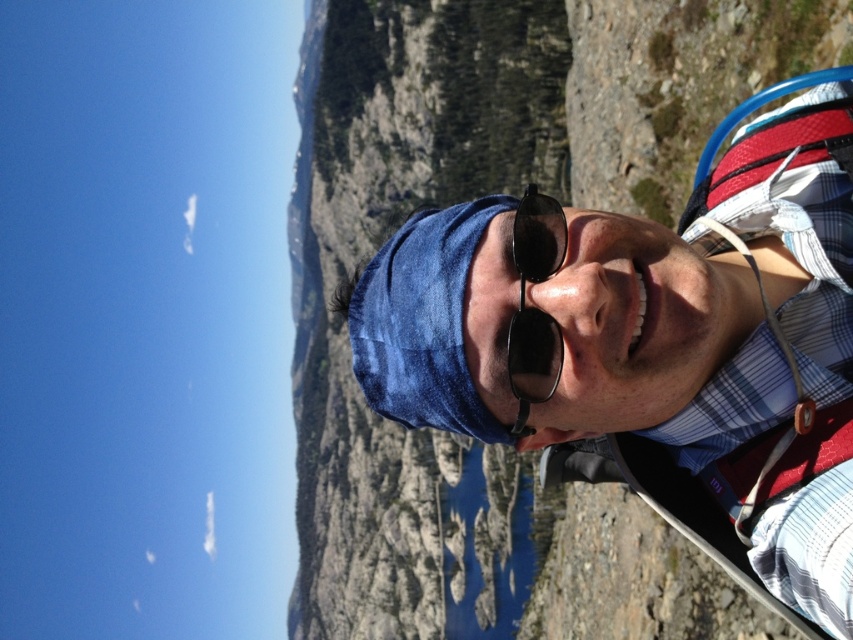
Who is taller, black reflective sunglasses at center or white fabric strap at right?

black reflective sunglasses at center is taller.

Describe the element at coordinates (532, 307) in the screenshot. I see `black reflective sunglasses at center` at that location.

Locate an element on the screen. The image size is (853, 640). black reflective sunglasses at center is located at coordinates (532, 307).

Which is more to the right, blue denim bandana at center or white fabric strap at right?

From the viewer's perspective, white fabric strap at right appears more on the right side.

Which is more to the left, blue denim bandana at center or white fabric strap at right?

blue denim bandana at center is more to the left.

Identify the location of blue denim bandana at center. This screenshot has width=853, height=640. coord(471,196).

Looking at this image, which is more to the right, blue denim bandana at center or black reflective sunglasses at center?

From the viewer's perspective, black reflective sunglasses at center appears more on the right side.

Does blue denim bandana at center have a lesser height compared to black reflective sunglasses at center?

No, blue denim bandana at center is not shorter than black reflective sunglasses at center.

What do you see at coordinates (471, 196) in the screenshot? I see `blue denim bandana at center` at bounding box center [471, 196].

Find the location of a particular element. blue denim bandana at center is located at coordinates (471, 196).